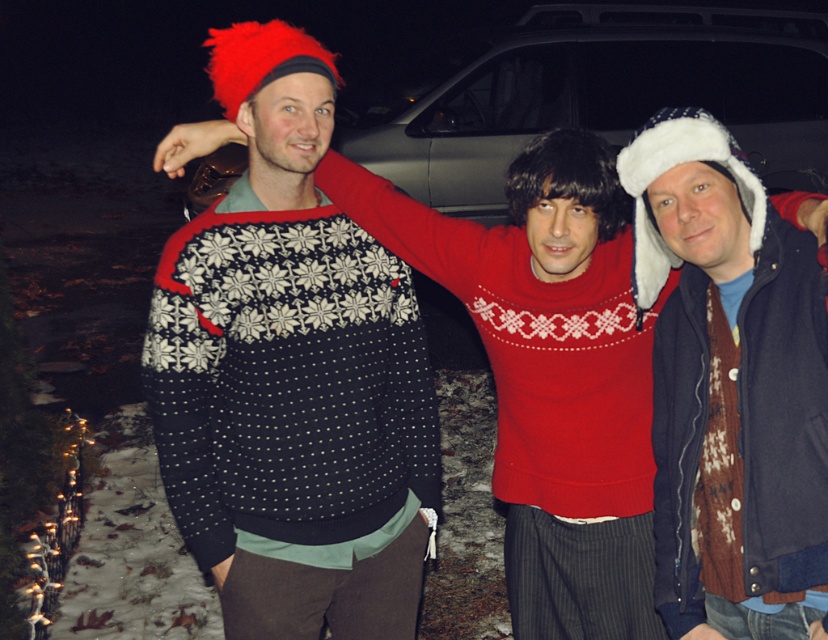
You are taking a photo of two points in the scene. The first point is at coordinate point [153,307] and the second is at point [701,99]. Which point will appear larger in the photo?

Point [153,307] is closer to the camera than point [701,99], so it will appear larger in the photo.

Based on the scene description, can you determine the spatial relationship between the knitted sweater at center and the metallic silver car at center? Please explain using their positions.

The knitted sweater at center is located below the metallic silver car at center, meaning the car is positioned higher up in the image while the sweater is situated lower down.